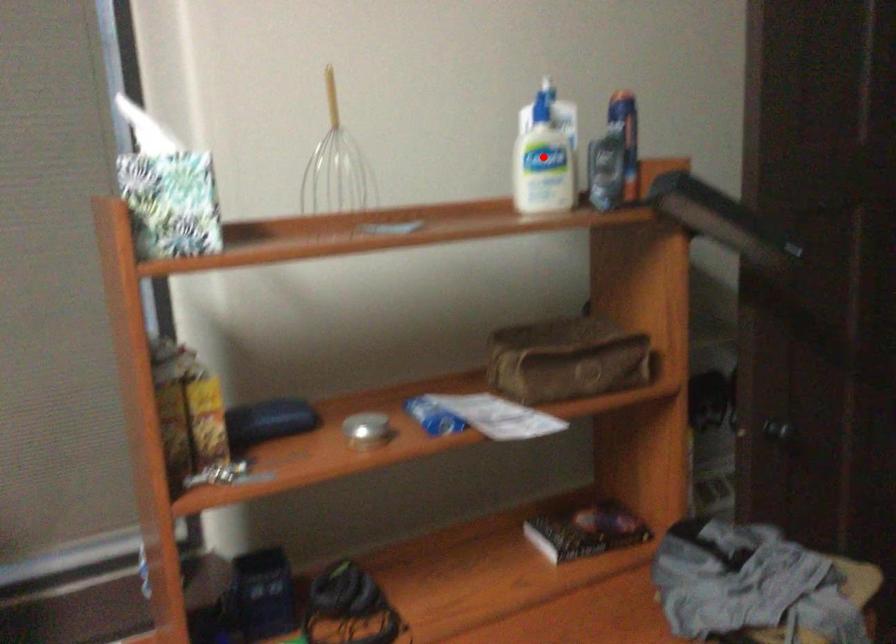
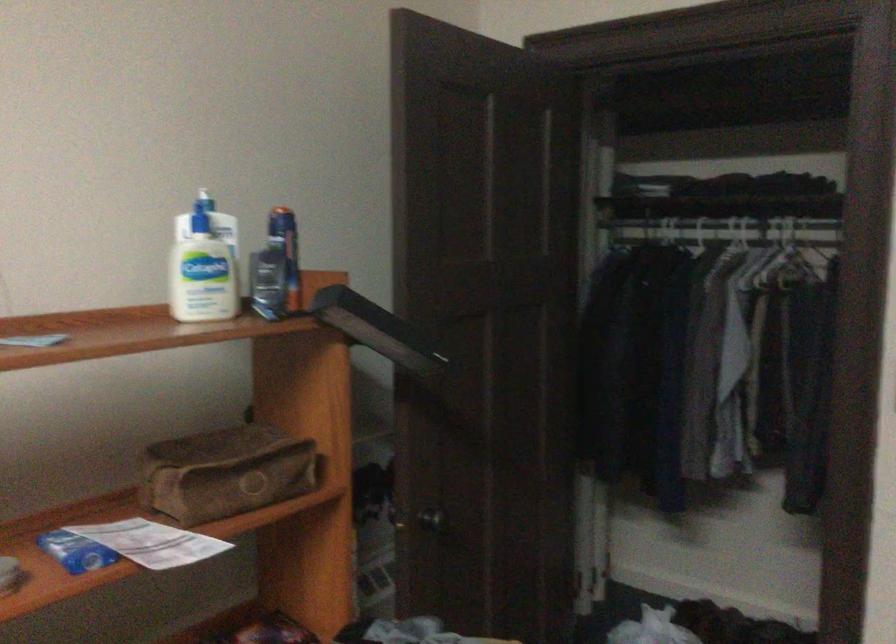
Find the pixel in the second image that matches the highlighted location in the first image.

(203, 265)